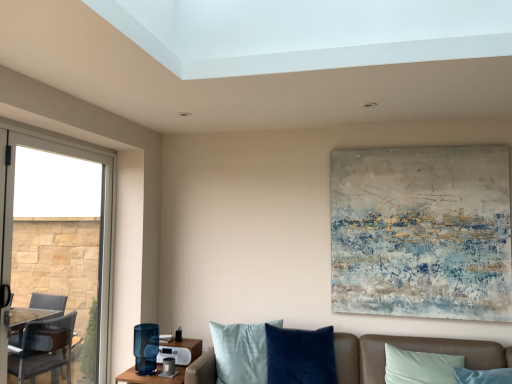
The width and height of the screenshot is (512, 384). Identify the location of free location above textured canvas painting at upper center (from a real-world perspective). (405, 146).